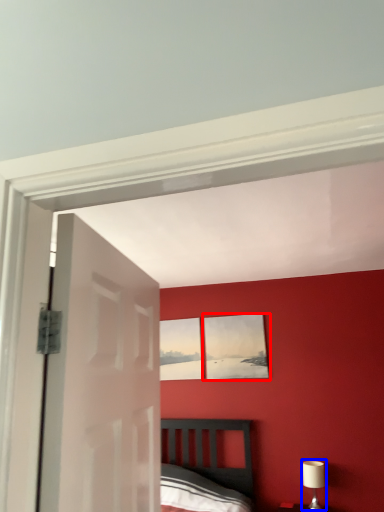
Question: Which object appears farthest to the camera in this image, picture frame (highlighted by a red box) or table lamp (highlighted by a blue box)?

Choices:
 (A) picture frame
 (B) table lamp

Answer: (A)